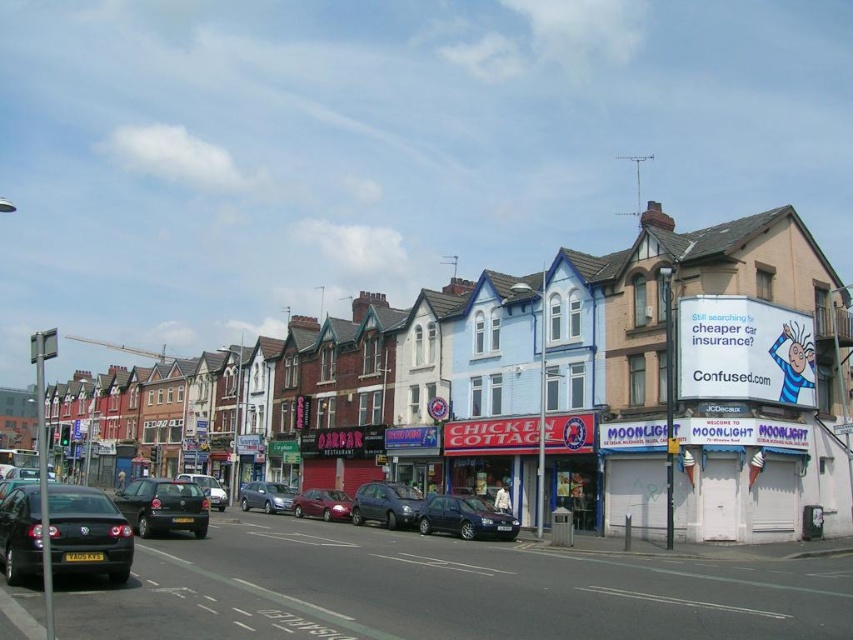
Question: Estimate the real-world distances between objects in this image. Which object is closer to the metallic blue hatchback at center?

Choices:
 (A) metallic blue sedan at center
 (B) metallic red sedan at center

Answer: (A)

Question: Among these points, which one is farthest from the camera?

Choices:
 (A) (606, 428)
 (B) (287, 496)
 (C) (114, 525)
 (D) (346, 518)

Answer: (B)

Question: Where is matte black car at center located in relation to metallic blue hatchback at center in the image?

Choices:
 (A) right
 (B) left

Answer: (B)

Question: Does matte black car at left have a larger size compared to metallic blue hatchback at center?

Choices:
 (A) no
 (B) yes

Answer: (B)

Question: Can you confirm if matte black car at left is positioned to the left of silver metallic sedan at center?

Choices:
 (A) yes
 (B) no

Answer: (A)

Question: Which is nearer to the shiny black sedan at left?

Choices:
 (A) metallic red sedan at center
 (B) shiny silver sedan at center
 (C) metallic blue hatchback at center

Answer: (C)